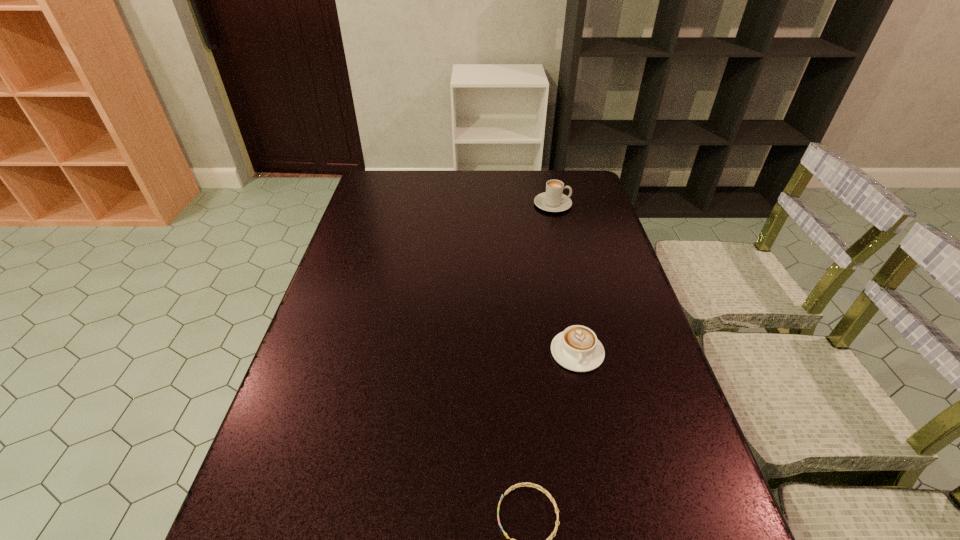
I want to click on free space at the right edge of the desktop, so click(612, 333).

I want to click on free region at the far left corner, so click(404, 175).

This screenshot has width=960, height=540. Identify the location of free spot between the taller cappuccino and the nearer cappuccino. (564, 278).

Where is `vacant space in between the farther cappuccino and the nearer cappuccino`? The width and height of the screenshot is (960, 540). vacant space in between the farther cappuccino and the nearer cappuccino is located at coordinates (564, 278).

Find the location of a particular element. blank region between the tallest object and the shorter cappuccino is located at coordinates (564, 278).

Where is `empty location between the tallest object and the nearer cappuccino`? The image size is (960, 540). empty location between the tallest object and the nearer cappuccino is located at coordinates (564, 278).

This screenshot has height=540, width=960. I want to click on free space between the nearer cappuccino and the farthest object, so click(564, 278).

Select which object appears as the second closest to the shorter cappuccino. Please provide its 2D coordinates. Your answer should be formatted as a tuple, i.e. [(x, y)], where the tuple contains the x and y coordinates of a point satisfying the conditions above.

[(552, 200)]

Identify the location of the closest object relative to the leftmost object. (577, 348).